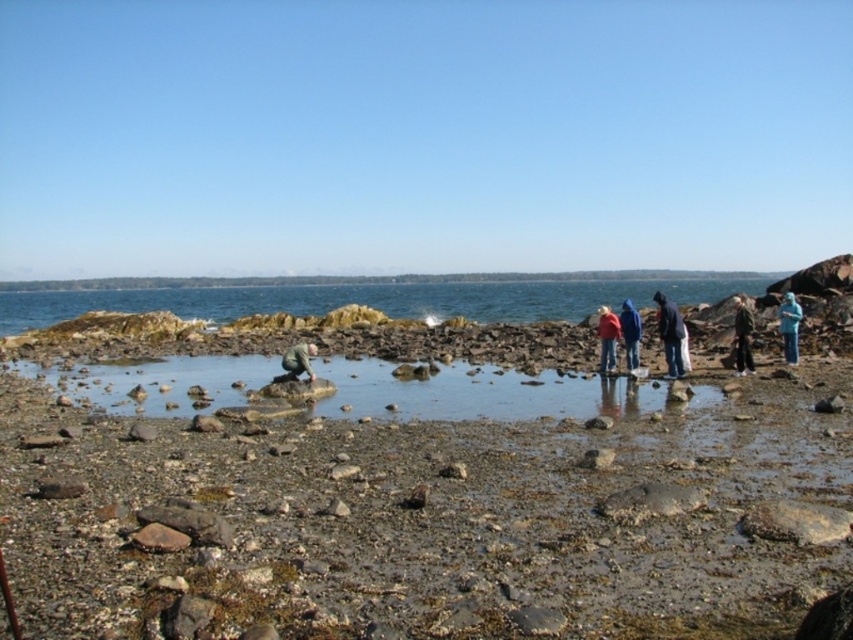
Does smooth pebbles at center appear over dark blue jacket at right?

Incorrect, smooth pebbles at center is not positioned above dark blue jacket at right.

Which is behind, point (801, 500) or point (659, 305)?

The point (659, 305) is more distant.

Is point (836, 465) in front of point (670, 355)?

Yes, point (836, 465) is closer to viewer.

The width and height of the screenshot is (853, 640). Find the location of `smooth pebbles at center`. smooth pebbles at center is located at coordinates (426, 522).

Consider the image. Is blue water at center above blue denim jacket at center?

Yes, blue water at center is above blue denim jacket at center.

Who is lower down, blue water at center or blue denim jacket at center?

blue denim jacket at center

Image resolution: width=853 pixels, height=640 pixels. What are the coordinates of `blue water at center` in the screenshot? It's located at (370, 300).

Image resolution: width=853 pixels, height=640 pixels. In order to click on blue water at center in this screenshot , I will do `click(370, 300)`.

Which is behind, point (160, 451) or point (427, 296)?

The point (427, 296) is behind.

Between smooth pebbles at center and blue water at center, which one is positioned lower?

smooth pebbles at center is lower down.

You are a GUI agent. You are given a task and a screenshot of the screen. Output one action in this format:
    pyautogui.click(x=<x>, y=<y>)
    Task: Click on the smooth pebbles at center
    Image resolution: width=853 pixels, height=640 pixels.
    Given the screenshot: What is the action you would take?
    pyautogui.click(x=426, y=522)